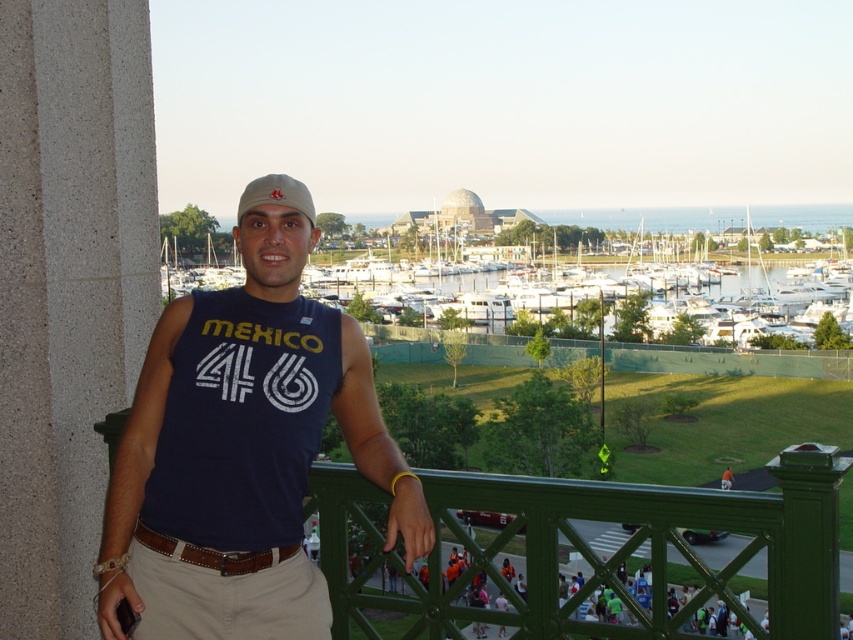
Question: Can you confirm if matte blue tank top at center is thinner than matte beige cap at center?

Choices:
 (A) yes
 (B) no

Answer: (A)

Question: Is matte blue tank top at center thinner than matte beige cap at center?

Choices:
 (A) no
 (B) yes

Answer: (B)

Question: Which point is closer to the camera taking this photo?

Choices:
 (A) (167, 572)
 (B) (276, 189)

Answer: (A)

Question: Does matte blue tank top at center appear under matte beige cap at center?

Choices:
 (A) no
 (B) yes

Answer: (B)